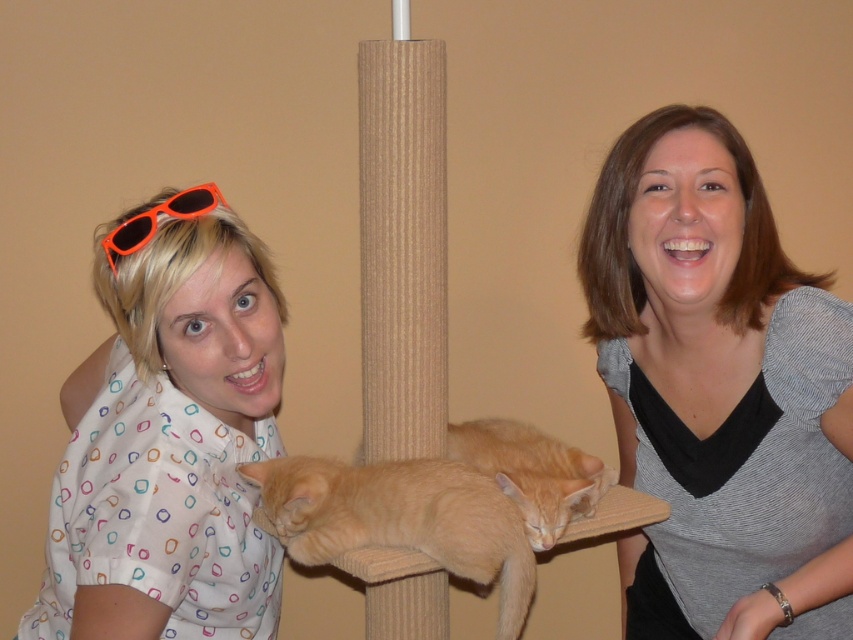
Can you confirm if white dotted shirt at left is positioned below orange plastic sunglasses at upper left?

Indeed, white dotted shirt at left is positioned under orange plastic sunglasses at upper left.

Which is more to the left, white dotted shirt at left or orange plastic sunglasses at upper left?

Positioned to the left is white dotted shirt at left.

The height and width of the screenshot is (640, 853). Identify the location of white dotted shirt at left. (173, 432).

I want to click on white dotted shirt at left, so click(x=173, y=432).

Between gray/black fabric shirt at center and orange plastic sunglasses at upper left, which one is positioned lower?

gray/black fabric shirt at center is below.

Is gray/black fabric shirt at center thinner than orange plastic sunglasses at upper left?

Incorrect, gray/black fabric shirt at center's width is not less than orange plastic sunglasses at upper left's.

The width and height of the screenshot is (853, 640). What do you see at coordinates (718, 390) in the screenshot?
I see `gray/black fabric shirt at center` at bounding box center [718, 390].

Locate an element on the screen. gray/black fabric shirt at center is located at coordinates (718, 390).

Does gray/black fabric shirt at center appear over orange fur cat at center?

Correct, gray/black fabric shirt at center is located above orange fur cat at center.

Is gray/black fabric shirt at center wider than orange fur cat at center?

No, gray/black fabric shirt at center is not wider than orange fur cat at center.

At what (x,y) coordinates should I click in order to perform the action: click on gray/black fabric shirt at center. Please return your answer as a coordinate pair (x, y). This screenshot has width=853, height=640. Looking at the image, I should click on (718, 390).